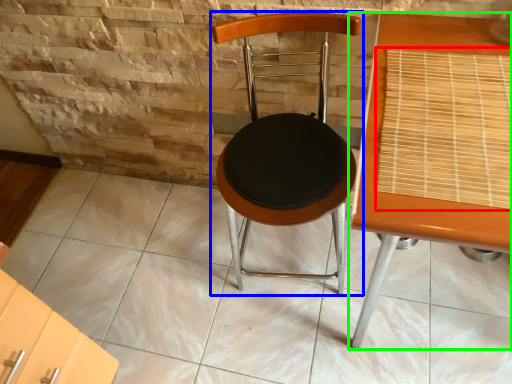
Question: Estimate the real-world distances between objects in this image. Which object is closer to mat (highlighted by a red box), chair (highlighted by a blue box) or table (highlighted by a green box)?

Choices:
 (A) chair
 (B) table

Answer: (B)